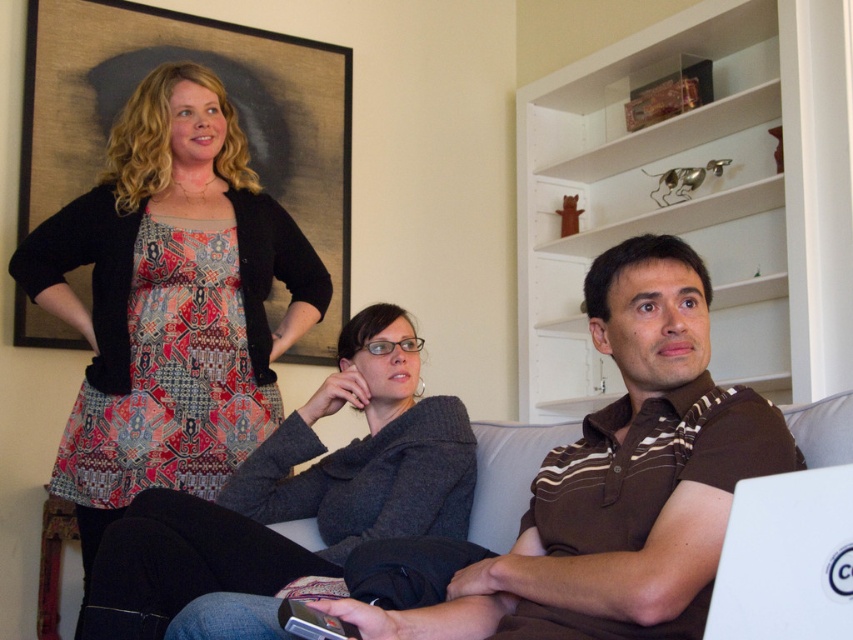
You are a photographer setting up a shoot in this living room. You need to place a small lamp between the brown striped shirt at center and the wooden framed artwork at upper left. According to the scene description, where should you position the lamp?

The lamp should be placed between the brown striped shirt at center and the wooden framed artwork at upper left, closer to the brown striped shirt at center since it is positioned on the right side of the wooden framed artwork at upper left.